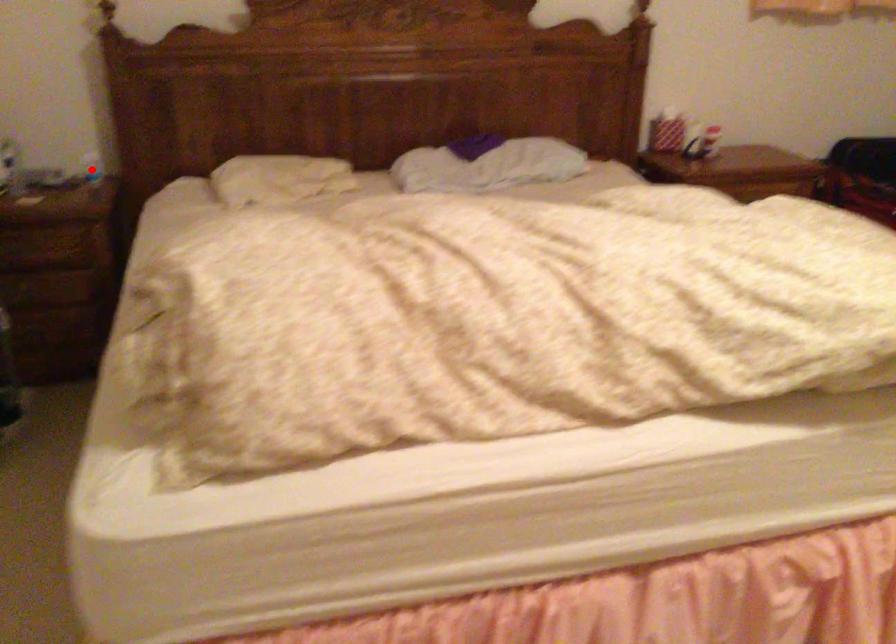
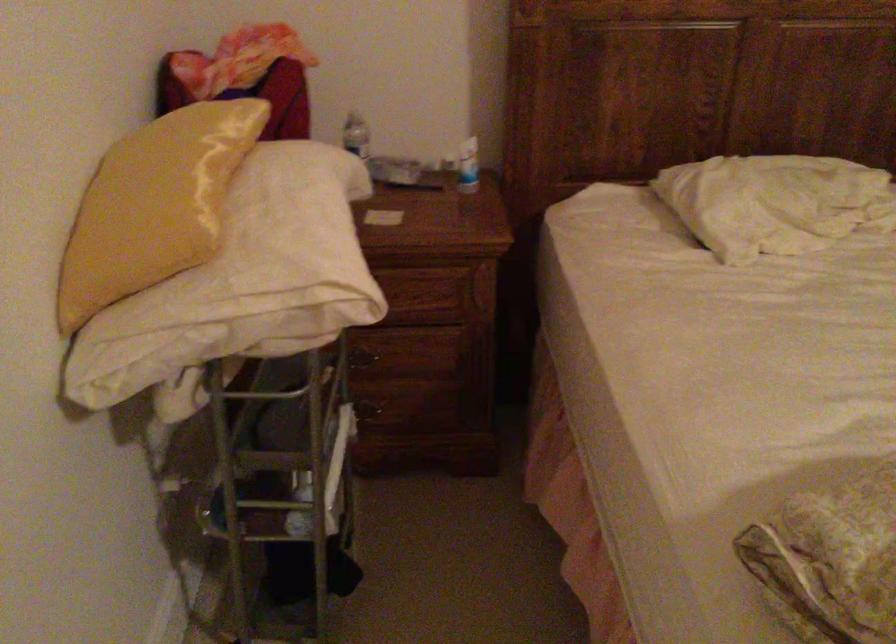
The point at the highlighted location is marked in the first image. Where is the corresponding point in the second image?

(468, 166)